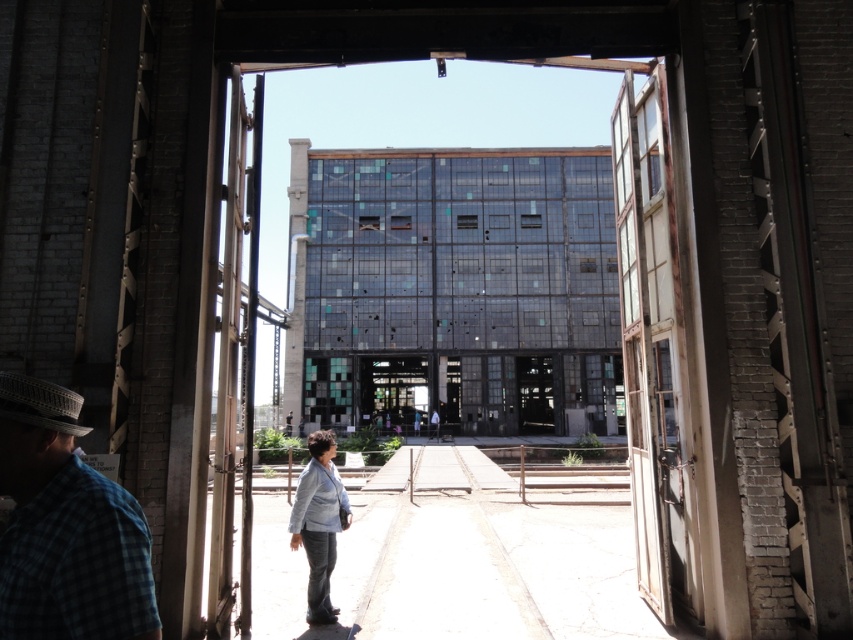
Does blue plaid shirt at lower left have a lesser width compared to white woven fedora at left?

Incorrect, blue plaid shirt at lower left's width is not less than white woven fedora at left's.

Is point (56, 616) positioned before point (16, 394)?

That is True.

Which is in front, point (94, 516) or point (49, 406)?

Point (94, 516) is in front.

Identify the location of blue plaid shirt at lower left. click(x=65, y=529).